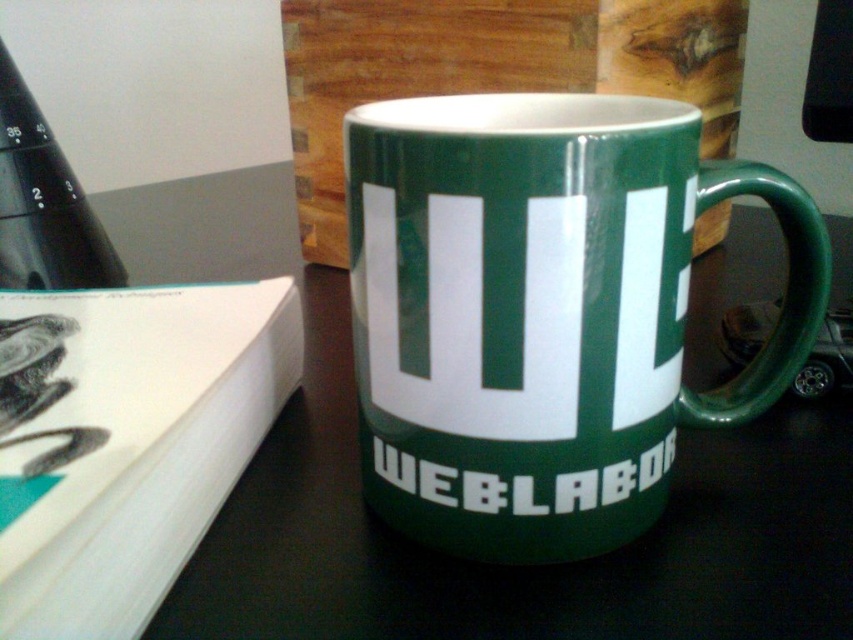
Question: Can you confirm if green glossy table at center is positioned above white paper at upper left?

Choices:
 (A) yes
 (B) no

Answer: (A)

Question: Does green glossy mug at center come behind green glossy table at center?

Choices:
 (A) no
 (B) yes

Answer: (A)

Question: Considering the real-world distances, which object is closest to the green glossy table at center?

Choices:
 (A) green glossy mug at center
 (B) white paper at upper left

Answer: (A)

Question: Can you confirm if green glossy table at center is positioned above white paper at upper left?

Choices:
 (A) no
 (B) yes

Answer: (B)

Question: Based on their relative distances, which object is nearer to the green glossy mug at center?

Choices:
 (A) white paper at upper left
 (B) green glossy table at center

Answer: (B)

Question: Estimate the real-world distances between objects in this image. Which object is closer to the green glossy table at center?

Choices:
 (A) white paper at upper left
 (B) green glossy mug at center

Answer: (B)